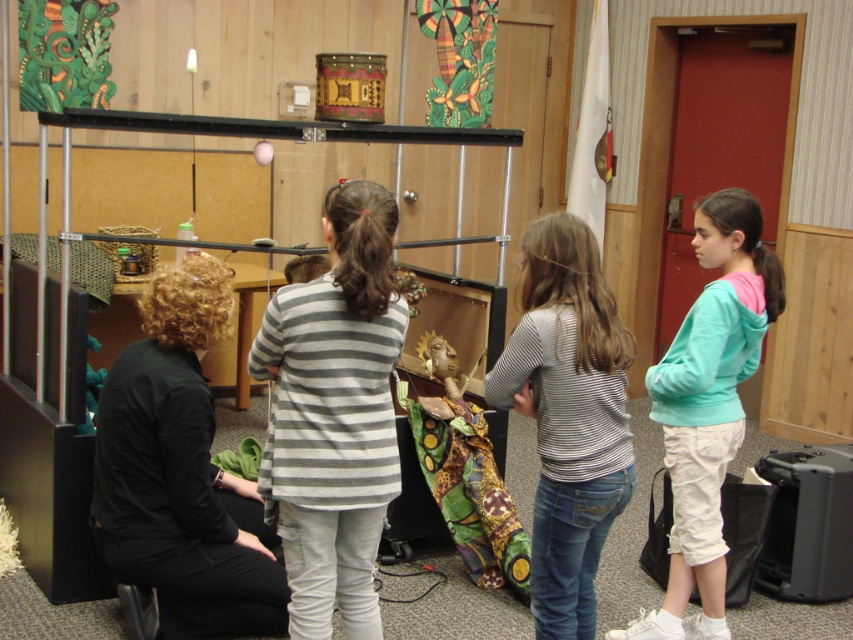
Question: Among these points, which one is farthest from the camera?

Choices:
 (A) (213, 332)
 (B) (572, 522)
 (C) (430, 358)

Answer: (C)

Question: Is striped cotton shirt at center to the left of teal hoodie at right from the viewer's perspective?

Choices:
 (A) no
 (B) yes

Answer: (B)

Question: Considering the real-world distances, which object is closest to the striped cotton shirt at center?

Choices:
 (A) teal hoodie at right
 (B) gray striped shirt at center
 (C) black matte jacket at lower left

Answer: (B)

Question: Is striped cotton shirt at center in front of matte brown wooden toy at center?

Choices:
 (A) no
 (B) yes

Answer: (B)

Question: Among these objects, which one is farthest from the camera?

Choices:
 (A) matte brown wooden toy at center
 (B) teal hoodie at right
 (C) striped cotton shirt at center
 (D) gray striped shirt at center

Answer: (A)

Question: Where is striped cotton shirt at center located in relation to matte brown wooden toy at center in the image?

Choices:
 (A) below
 (B) above

Answer: (A)